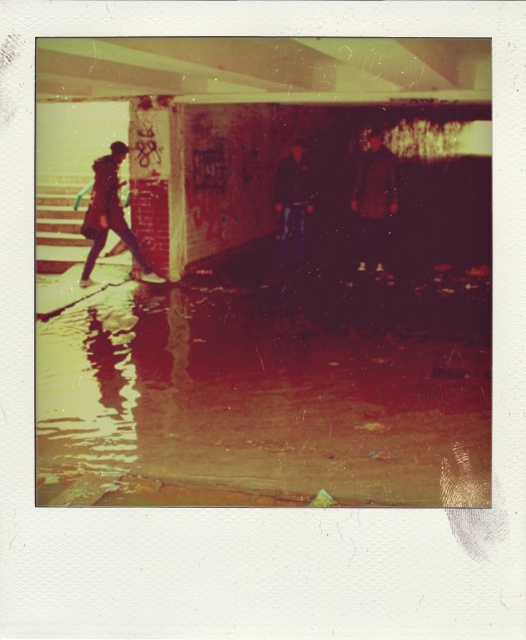
Question: Is matte brown coat at center below matte black jacket at left?

Choices:
 (A) yes
 (B) no

Answer: (B)

Question: Can you confirm if wet concrete pavement at lower center is bigger than matte black jacket at left?

Choices:
 (A) no
 (B) yes

Answer: (B)

Question: Is matte brown coat at center thinner than dark blue fabric jacket at center?

Choices:
 (A) yes
 (B) no

Answer: (B)

Question: Which object is positioned farthest from the matte black jacket at left?

Choices:
 (A) dark blue fabric jacket at center
 (B) matte brown coat at center
 (C) wet concrete pavement at lower center

Answer: (B)

Question: Which point is farther to the camera?

Choices:
 (A) matte brown coat at center
 (B) wet concrete pavement at lower center

Answer: (A)

Question: Among these points, which one is farthest from the camera?

Choices:
 (A) (282, 248)
 (B) (96, 246)
 (C) (355, 180)
 (D) (189, 406)

Answer: (A)